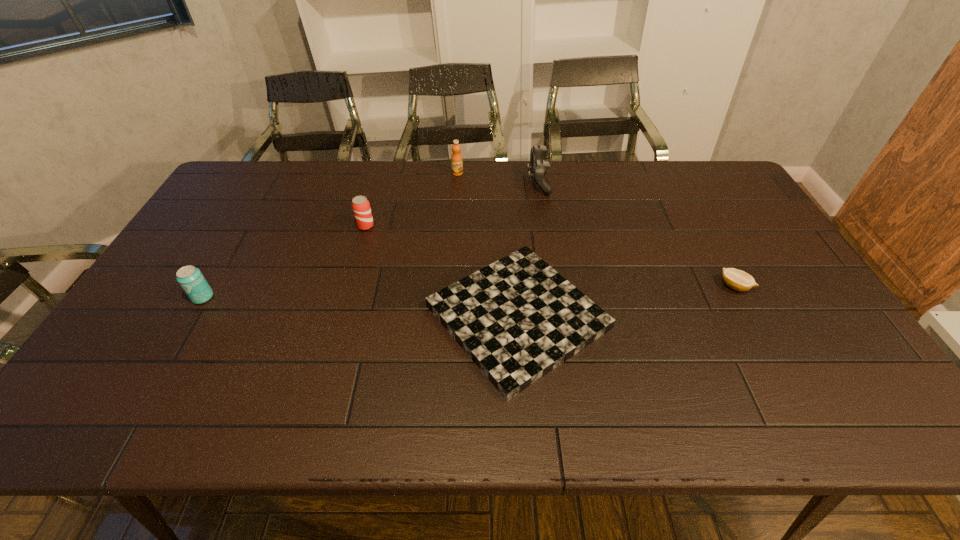
You are a GUI agent. You are given a task and a screenshot of the screen. Output one action in this format:
    pyautogui.click(x=<x>, y=<y>)
    Task: Click on the free point between the leftmost object and the orange juice
    
    Given the screenshot: What is the action you would take?
    pyautogui.click(x=330, y=235)

Where is `free space between the left beer can and the shortest object`? Image resolution: width=960 pixels, height=540 pixels. free space between the left beer can and the shortest object is located at coordinates (360, 307).

The image size is (960, 540). Find the location of `unoccupied area between the right beer can and the orange juice`. unoccupied area between the right beer can and the orange juice is located at coordinates (412, 199).

The width and height of the screenshot is (960, 540). I want to click on unoccupied position between the lemon and the shortest object, so click(x=626, y=302).

Locate an element on the screen. free space between the control and the right beer can is located at coordinates [x=451, y=204].

In order to click on the fourth closest object to the fifth tallest object in this screenshot , I will do `click(360, 205)`.

You are a GUI agent. You are given a task and a screenshot of the screen. Output one action in this format:
    pyautogui.click(x=<x>, y=<y>)
    Task: Click on the object that can be found as the closest to the leftmost object
    This screenshot has width=960, height=540.
    Given the screenshot: What is the action you would take?
    click(360, 205)

Locate an element on the screen. free space that satisfies the following two spatial constraints: 1. on the front side of the shortest object; 2. on the left side of the farther beer can is located at coordinates (340, 317).

The height and width of the screenshot is (540, 960). Find the location of `vacant position in the image that satisfies the following two spatial constraints: 1. on the back side of the checkerboard; 2. on the left side of the second shortest object`. vacant position in the image that satisfies the following two spatial constraints: 1. on the back side of the checkerboard; 2. on the left side of the second shortest object is located at coordinates (516, 286).

Where is `free space in the image that satisfies the following two spatial constraints: 1. on the surface of the control with buttons; 2. on the left side of the fifth tallest object`? free space in the image that satisfies the following two spatial constraints: 1. on the surface of the control with buttons; 2. on the left side of the fifth tallest object is located at coordinates (554, 286).